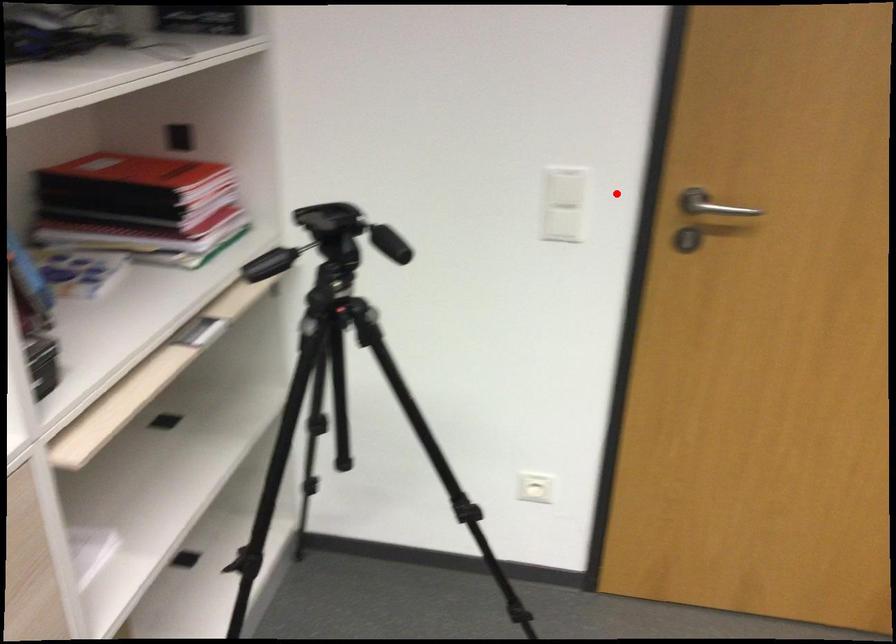
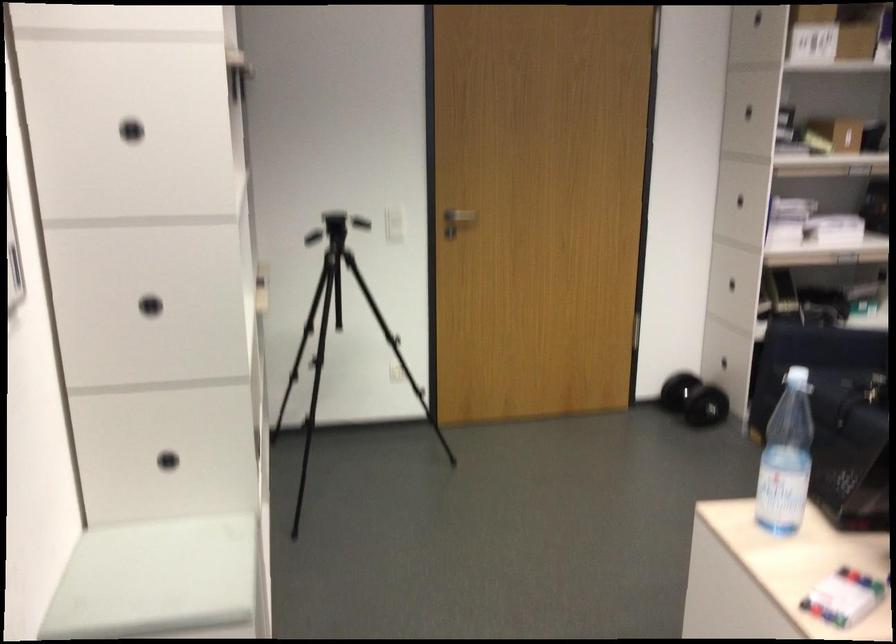
Question: I am providing you with two images of the same scene from different viewpoints. In image1, a red point is highlighted. Considering the same 3D point in image2, which of the following is correct?

Choices:
 (A) It is closer
 (B) It is farther

Answer: (B)